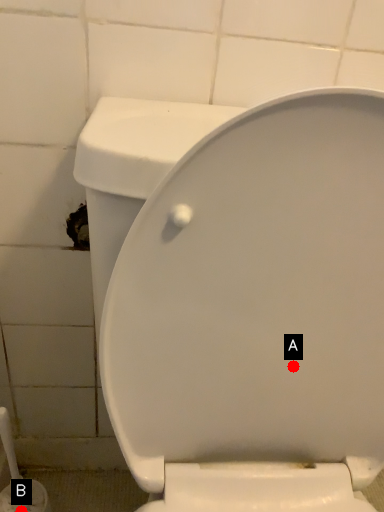
Question: Two points are circled on the image, labeled by A and B beside each circle. Which point is closer to the camera taking this photo?

Choices:
 (A) A is closer
 (B) B is closer

Answer: (A)